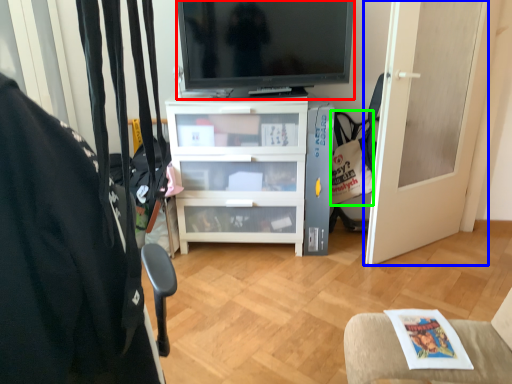
Question: Which is nearer to the television (highlighted by a red box)? door (highlighted by a blue box) or handbag (highlighted by a green box).

Choices:
 (A) door
 (B) handbag

Answer: (B)